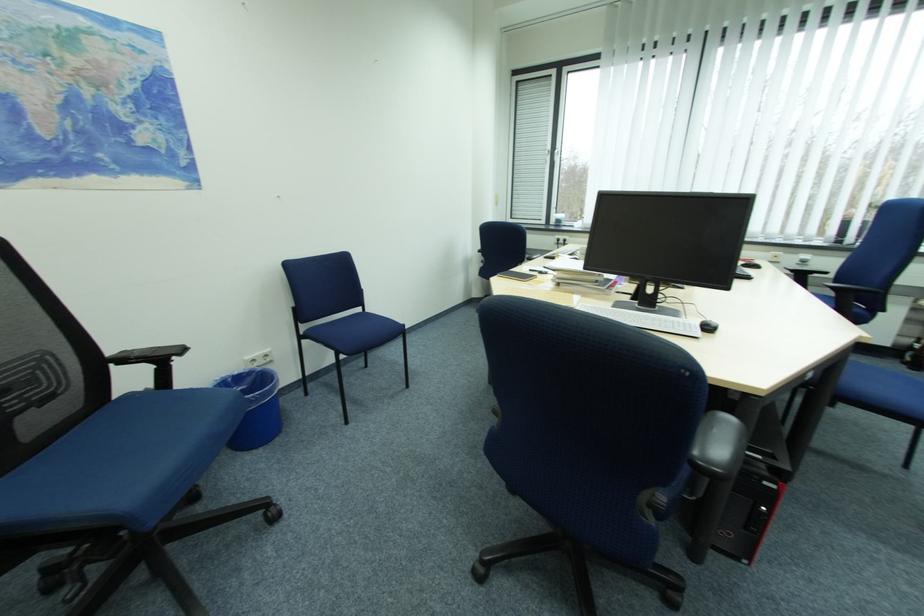
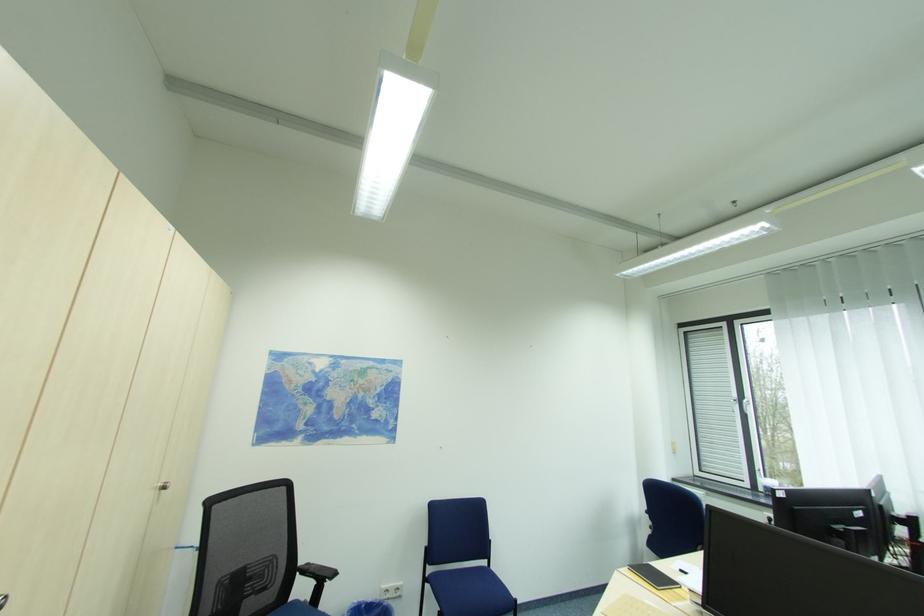
The first image is from the beginning of the video and the second image is from the end. How did the camera likely rotate when shooting the video?

The camera's rotation is toward left-up.